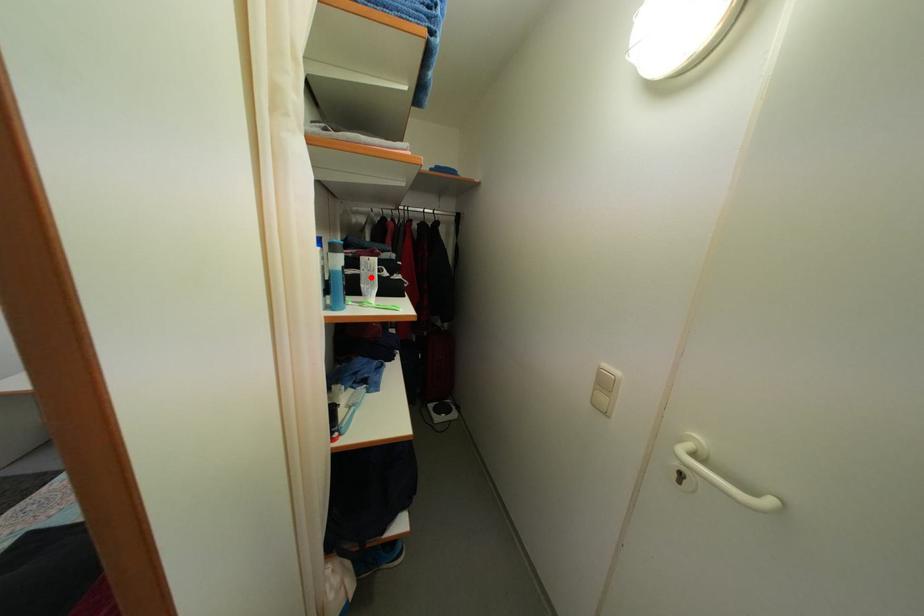
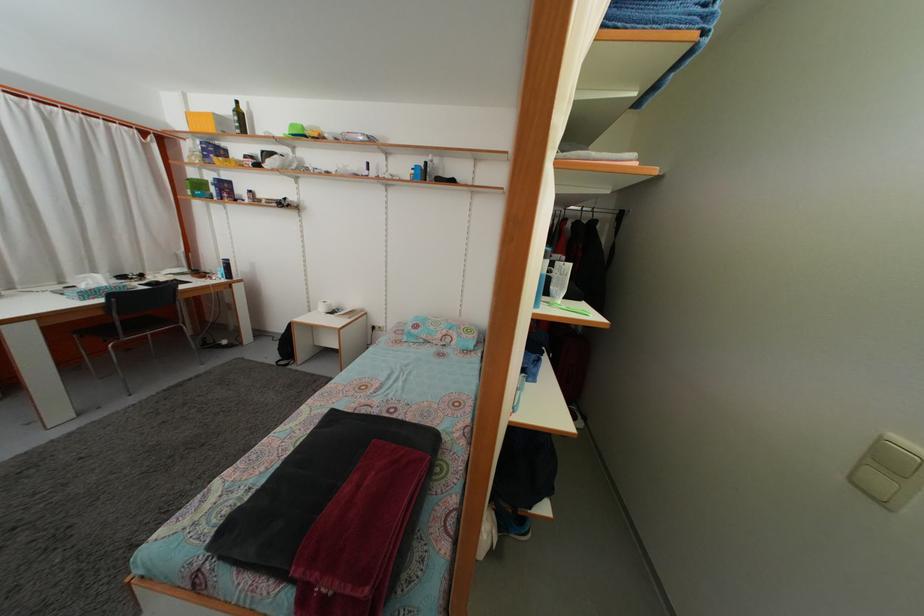
Locate, in the second image, the point that corresponds to the highlighted location in the first image.

(564, 282)